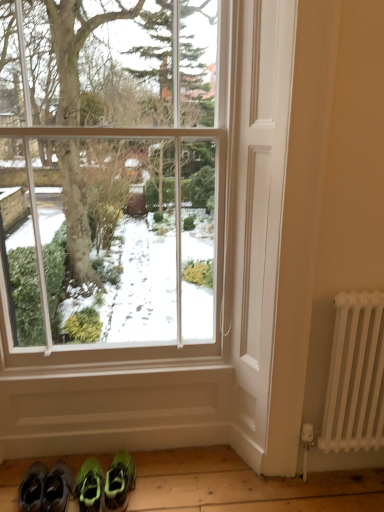
Question: Is green suede sneakers at lower left, the second footwear in the right-to-left sequence, bigger than clear glass window at center?

Choices:
 (A) no
 (B) yes

Answer: (A)

Question: Does green suede sneakers at lower left, which appears as the 2th footwear when viewed from the left, come behind clear glass window at center?

Choices:
 (A) no
 (B) yes

Answer: (B)

Question: Is green suede sneakers at lower left, the second footwear in the right-to-left sequence, closer to the viewer compared to clear glass window at center?

Choices:
 (A) no
 (B) yes

Answer: (A)

Question: Is green suede sneakers at lower left, the second footwear in the right-to-left sequence, positioned far away from clear glass window at center?

Choices:
 (A) yes
 (B) no

Answer: (A)

Question: Does green suede sneakers at lower left, the second footwear in the right-to-left sequence, have a greater height compared to clear glass window at center?

Choices:
 (A) yes
 (B) no

Answer: (B)

Question: Looking at their shapes, would you say green suede sneakers at lower left, which appears as the 2th footwear when viewed from the left, is wider or thinner than green suede sneakers at lower left, which is the first footwear from left to right?

Choices:
 (A) wide
 (B) thin

Answer: (A)

Question: From their relative heights in the image, would you say green suede sneakers at lower left, which appears as the 2th footwear when viewed from the left, is taller or shorter than green suede sneakers at lower left, the third footwear viewed from the right?

Choices:
 (A) tall
 (B) short

Answer: (B)

Question: In the image, is green suede sneakers at lower left, the second footwear in the right-to-left sequence, on the left side or the right side of green suede sneakers at lower left, the third footwear viewed from the right?

Choices:
 (A) left
 (B) right

Answer: (B)

Question: Is green suede sneakers at lower left, which appears as the 2th footwear when viewed from the left, situated inside green suede sneakers at lower left, which is the first footwear from left to right, or outside?

Choices:
 (A) outside
 (B) inside

Answer: (A)

Question: From a real-world perspective, relative to white metal radiator at right, is green suede sneakers at lower left, the third footwear viewed from the right, vertically above or below?

Choices:
 (A) below
 (B) above

Answer: (A)

Question: From the image's perspective, is green suede sneakers at lower left, the third footwear viewed from the right, positioned above or below white metal radiator at right?

Choices:
 (A) above
 (B) below

Answer: (B)

Question: In the image, is green suede sneakers at lower left, the third footwear viewed from the right, positioned in front of or behind white metal radiator at right?

Choices:
 (A) behind
 (B) front

Answer: (A)

Question: Based on their positions, is green suede sneakers at lower left, which is the first footwear from left to right, located to the left or right of white metal radiator at right?

Choices:
 (A) right
 (B) left

Answer: (B)

Question: In the image, is green suede sneakers at lower left, which is the first footwear from left to right, on the left side or the right side of green suede sneakers at lower left, which appears as the 2th footwear when viewed from the left?

Choices:
 (A) right
 (B) left

Answer: (B)

Question: Considering the positions of green suede sneakers at lower left, which is the first footwear from left to right, and green suede sneakers at lower left, the second footwear in the right-to-left sequence, in the image, is green suede sneakers at lower left, which is the first footwear from left to right, taller or shorter than green suede sneakers at lower left, the second footwear in the right-to-left sequence,?

Choices:
 (A) short
 (B) tall

Answer: (B)